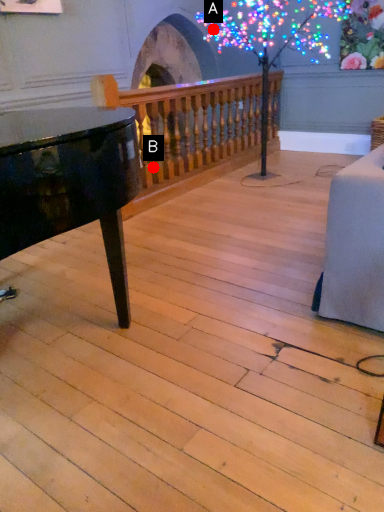
Question: Two points are circled on the image, labeled by A and B beside each circle. Which point is closer to the camera taking this photo?

Choices:
 (A) A is closer
 (B) B is closer

Answer: (B)